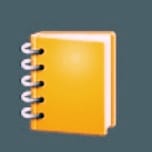
Identify the location of yellow back cover inside edge of the notebook. (113, 64).